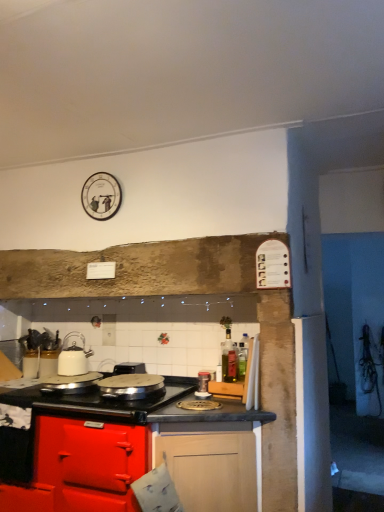
Question: Can you confirm if shiny silver pan at center, the 1th kitchen appliance from the left, is positioned to the right of glossy wood cabinet at lower center?

Choices:
 (A) yes
 (B) no

Answer: (B)

Question: Would you say shiny silver pan at center, placed as the 3th kitchen appliance when sorted from right to left, is outside glossy wood cabinet at lower center?

Choices:
 (A) yes
 (B) no

Answer: (B)

Question: Is shiny silver pan at center, the 1th kitchen appliance from the left, far away from glossy wood cabinet at lower center?

Choices:
 (A) yes
 (B) no

Answer: (B)

Question: Does shiny silver pan at center, placed as the 3th kitchen appliance when sorted from right to left, have a greater width compared to glossy wood cabinet at lower center?

Choices:
 (A) no
 (B) yes

Answer: (A)

Question: Is shiny silver pan at center, the 1th kitchen appliance from the left, looking in the opposite direction of glossy wood cabinet at lower center?

Choices:
 (A) no
 (B) yes

Answer: (B)

Question: Considering the positions of glossy wood cabinet at lower center and black plastic toaster at center in the image, is glossy wood cabinet at lower center wider or thinner than black plastic toaster at center?

Choices:
 (A) thin
 (B) wide

Answer: (B)

Question: Based on their sizes in the image, would you say glossy wood cabinet at lower center is bigger or smaller than black plastic toaster at center?

Choices:
 (A) big
 (B) small

Answer: (A)

Question: In terms of height, does glossy wood cabinet at lower center look taller or shorter compared to black plastic toaster at center?

Choices:
 (A) tall
 (B) short

Answer: (A)

Question: From the image's perspective, is glossy wood cabinet at lower center positioned above or below black plastic toaster at center?

Choices:
 (A) below
 (B) above

Answer: (A)

Question: In terms of width, does green glass bottle at center look wider or thinner when compared to white glossy kettle at left, marked as the second kitchen appliance in a left-to-right arrangement?

Choices:
 (A) wide
 (B) thin

Answer: (B)

Question: Which is correct: green glass bottle at center is inside white glossy kettle at left, marked as the second kitchen appliance in a left-to-right arrangement, or outside of it?

Choices:
 (A) inside
 (B) outside

Answer: (B)

Question: From the image's perspective, is green glass bottle at center positioned above or below white glossy kettle at left, marked as the second kitchen appliance in a right-to-left arrangement?

Choices:
 (A) above
 (B) below

Answer: (B)

Question: Looking at the image, does green glass bottle at center seem bigger or smaller compared to white glossy kettle at left, marked as the second kitchen appliance in a right-to-left arrangement?

Choices:
 (A) small
 (B) big

Answer: (A)

Question: Is point (233, 374) positioned closer to the camera than point (140, 364)?

Choices:
 (A) farther
 (B) closer

Answer: (B)

Question: Is green glass bottle at center taller or shorter than black plastic toaster at center?

Choices:
 (A) short
 (B) tall

Answer: (B)